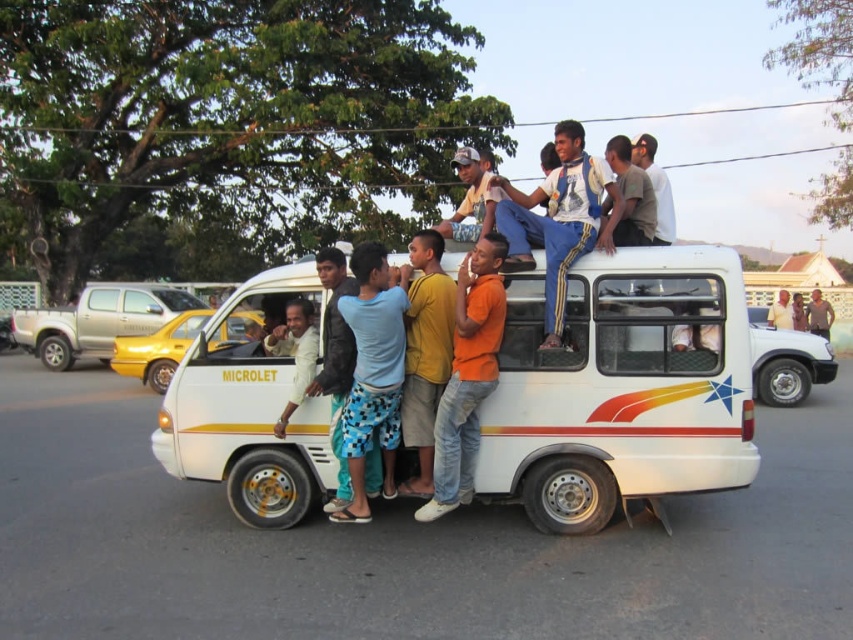
You are standing at the origin point of the street scene. The white matte van at center is located at coordinates 0.606 on the x axis and 0.729 on the y axis. If you want to walk directly to the van from your current position, in which general direction should you move? Please specify the direction as a combination of left, right, forward, or backward.

Since the white matte van at center is located at coordinates x 0.606 and y 0.729, and you are at the origin, you should move forward and to the right to reach it.